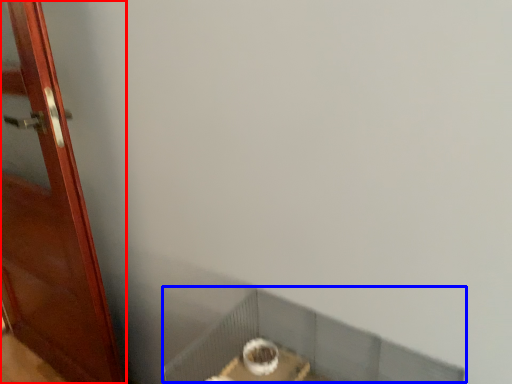
Question: Among these objects, which one is farthest to the camera, door (highlighted by a red box) or window sill (highlighted by a blue box)?

Choices:
 (A) door
 (B) window sill

Answer: (A)